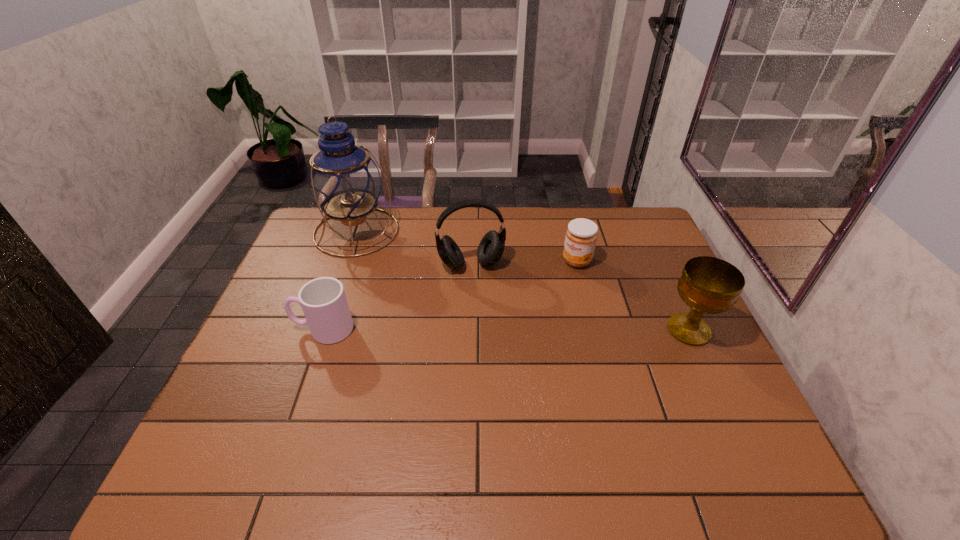
I want to click on cup, so click(x=323, y=300).

Find the location of a particular element. chalice is located at coordinates (708, 285).

At what (x,y) coordinates should I click in order to perform the action: click on the fourth object from left to right. Please return your answer as a coordinate pair (x, y). The width and height of the screenshot is (960, 540). Looking at the image, I should click on (581, 236).

Identify the location of the third object from right to left. Image resolution: width=960 pixels, height=540 pixels. (491, 248).

Find the location of a particular element. Image resolution: width=960 pixels, height=540 pixels. lantern is located at coordinates (344, 181).

What are the coordinates of `free space located on the back of the chalice` in the screenshot? It's located at (659, 265).

Where is `vacant space situated on the front label of the jam`? vacant space situated on the front label of the jam is located at coordinates (512, 331).

Where is `vacant area located on the front label of the jam`? vacant area located on the front label of the jam is located at coordinates point(498,345).

Identify the location of free spot located on the front label of the jam. (517, 325).

Find the location of a particular element. This screenshot has width=960, height=540. free location located on the ear cups of the headset is located at coordinates 503,380.